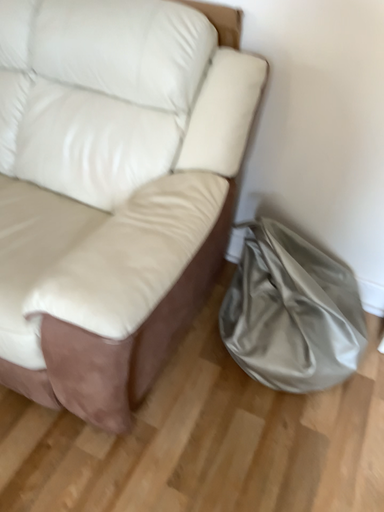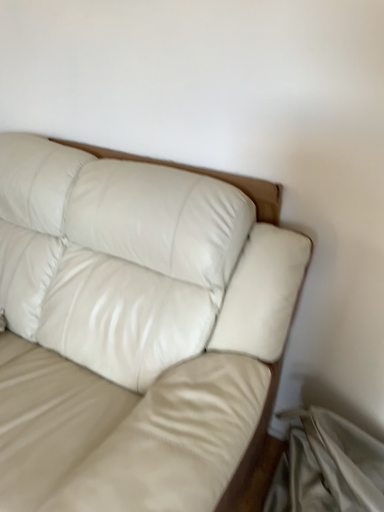
Question: How did the camera likely rotate when shooting the video?

Choices:
 (A) rotated downward
 (B) rotated upward

Answer: (B)